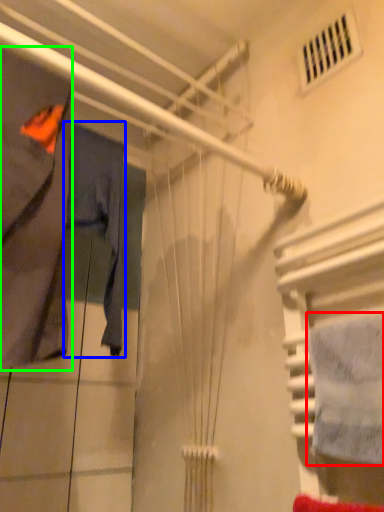
Question: Which is nearer to the towel (highlighted by a red box)? clothing (highlighted by a blue box) or clothing (highlighted by a green box).

Choices:
 (A) clothing
 (B) clothing

Answer: (B)